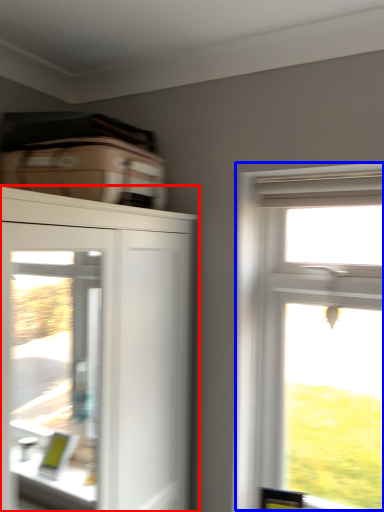
Question: Which of the following is the closest to the observer, cupboard (highlighted by a red box) or window (highlighted by a blue box)?

Choices:
 (A) cupboard
 (B) window

Answer: (A)